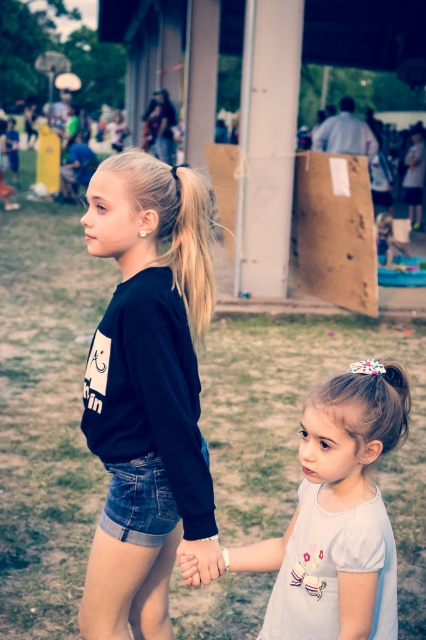
Which is in front, point (347, 419) or point (184, 294)?

Point (347, 419)

Does point (382, 392) lie in front of point (181, 189)?

Yes, point (382, 392) is closer to viewer.

Find the location of a particular element. white matte dress at lower right is located at coordinates (336, 516).

Is blonde hair at upper center above smooth skin hand at center?

Yes, blonde hair at upper center is above smooth skin hand at center.

Is point (192, 228) farther from viewer compared to point (215, 566)?

Yes, point (192, 228) is farther from viewer.

Is point (170, 177) positioned after point (178, 554)?

Yes, point (170, 177) is behind point (178, 554).

Where is `blonde hair at upper center`? The height and width of the screenshot is (640, 426). blonde hair at upper center is located at coordinates coord(187,241).

Which is more to the left, black matte sweatshirt at center or matte black dress at upper center?

Positioned to the left is matte black dress at upper center.

Is black matte sweatshirt at center wider than matte black dress at upper center?

No, black matte sweatshirt at center is not wider than matte black dress at upper center.

This screenshot has height=640, width=426. What do you see at coordinates (146, 380) in the screenshot?
I see `black matte sweatshirt at center` at bounding box center [146, 380].

Where is `black matte sweatshirt at center`? black matte sweatshirt at center is located at coordinates (146, 380).